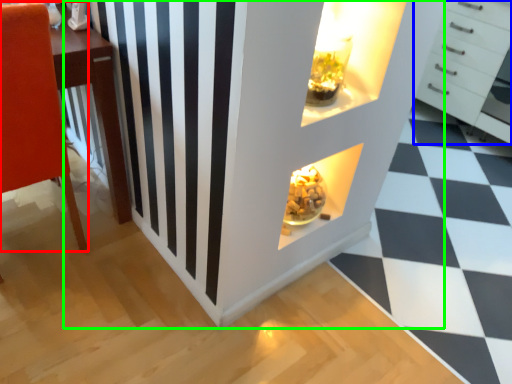
Question: Which is nearer to the furniture (highlighted by a red box)? chest of drawers (highlighted by a blue box) or dresser (highlighted by a green box).

Choices:
 (A) chest of drawers
 (B) dresser

Answer: (B)